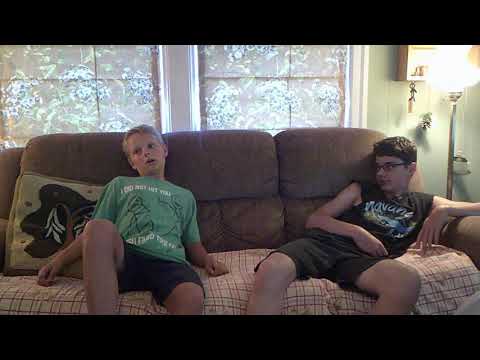
Where is `sheet on couch to sit on`? sheet on couch to sit on is located at coordinates (223, 281).